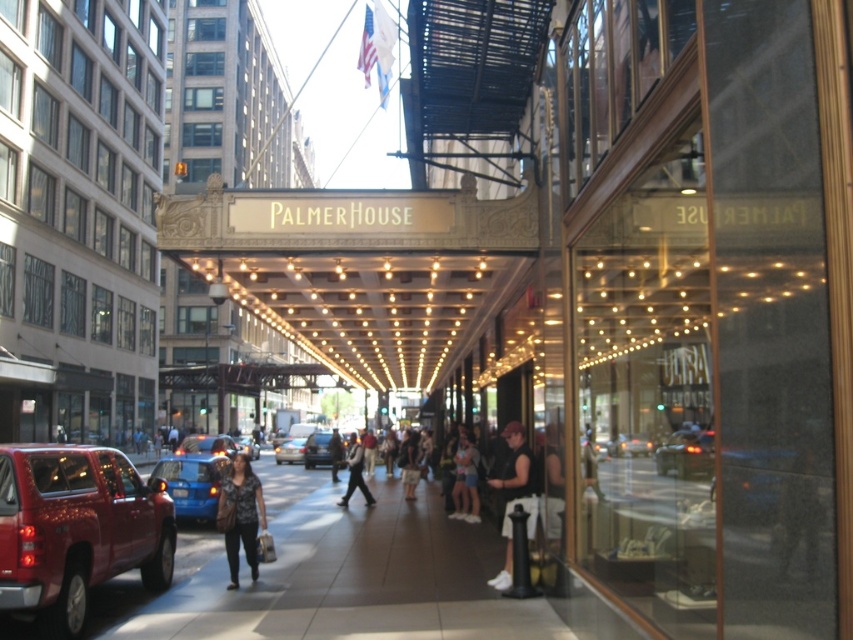
Question: Is blue glossy car at center to the right of matte black jacket at center from the viewer's perspective?

Choices:
 (A) no
 (B) yes

Answer: (A)

Question: Which of these objects is positioned farthest from the smooth concrete sidewalk at center?

Choices:
 (A) metallic red truck at lower left
 (B) denim shorts at center

Answer: (A)

Question: Does matte black sedan at center appear over matte black jacket at center?

Choices:
 (A) no
 (B) yes

Answer: (A)

Question: Which point is closer to the camera?

Choices:
 (A) (253, 444)
 (B) (341, 451)

Answer: (B)

Question: Considering the real-world distances, which object is farthest from the black leather jacket at center?

Choices:
 (A) denim shorts at center
 (B) blue metallic car at center
 (C) matte black sedan at center

Answer: (B)

Question: Does dark gray textured pants at center have a larger size compared to matte black jacket at center?

Choices:
 (A) no
 (B) yes

Answer: (A)